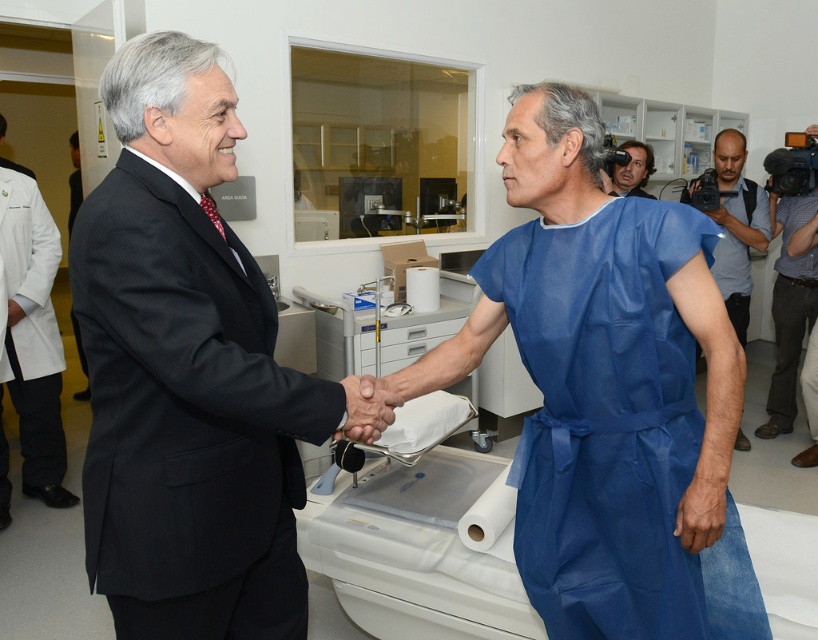
Question: Which point is farther to the camera?

Choices:
 (A) blue fabric gown at center
 (B) blue scrubs at center
 (C) blue scrubs at right

Answer: (C)

Question: In this image, where is blue scrubs at center located relative to blue fabric gown at center?

Choices:
 (A) right
 (B) left

Answer: (B)

Question: Which object is the closest to the blue scrubs at center?

Choices:
 (A) blue fabric gown at center
 (B) blue scrubs at right

Answer: (A)

Question: Is blue scrubs at right thinner than blue fabric gown at center?

Choices:
 (A) no
 (B) yes

Answer: (A)

Question: Estimate the real-world distances between objects in this image. Which object is farther from the blue fabric gown at center?

Choices:
 (A) blue scrubs at center
 (B) blue scrubs at right

Answer: (A)

Question: Can you confirm if blue scrubs at center is positioned below blue scrubs at right?

Choices:
 (A) no
 (B) yes

Answer: (B)